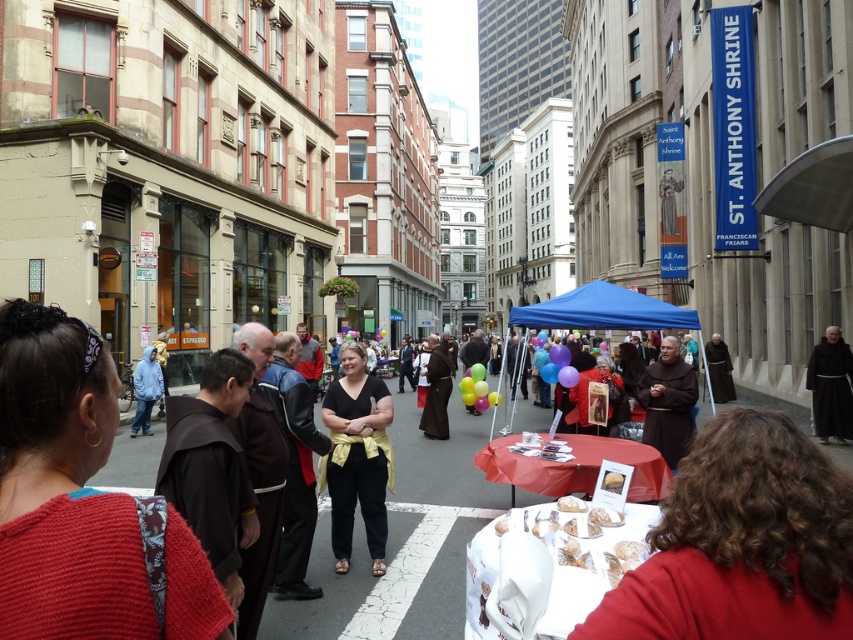
Question: Which is nearer to the white sugared donuts at lower center?

Choices:
 (A) blue fabric canopy at center
 (B) black matte shirt at center

Answer: (B)

Question: Does black matte shirt at center have a smaller size compared to blue fabric canopy at center?

Choices:
 (A) no
 (B) yes

Answer: (B)

Question: Which object is closer to the camera taking this photo?

Choices:
 (A) black matte shirt at center
 (B) white sugared donuts at lower center

Answer: (B)

Question: Which object is positioned farthest from the blue fabric canopy at center?

Choices:
 (A) white sugared donuts at lower center
 (B) black matte shirt at center

Answer: (A)

Question: Is black matte shirt at center below blue fabric canopy at center?

Choices:
 (A) yes
 (B) no

Answer: (A)

Question: Is black matte shirt at center below blue fabric canopy at center?

Choices:
 (A) yes
 (B) no

Answer: (A)